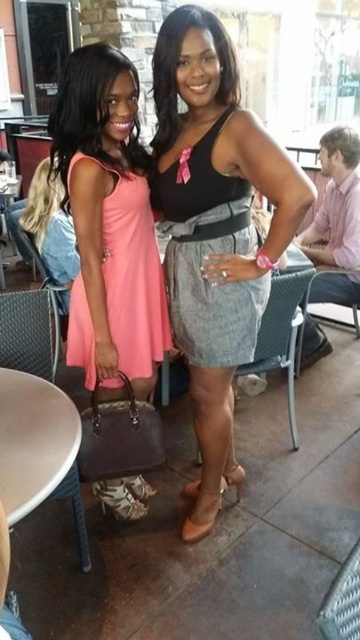
You are a photographer trying to capture a clear shot of both the matte pink dress at left and the gray fabric belt at center. Since you want both items to be in focus, you need to adjust your camera settings. Considering their positions, which object should you focus on to ensure both are sharp?

You should focus on the matte pink dress at left because it is closer to the viewer, and by focusing on the closer object, the gray fabric belt at center will also be in focus due to the depth of field extending beyond it.

You are a fashion designer observing two women at a casual outdoor event. One is wearing a gray textured dress at center and the other has a gray fabric belt at center. Which clothing item is positioned closer to the front in the image?

The gray textured dress at center is positioned in front of the gray fabric belt at center, making it closer to the front in the image.